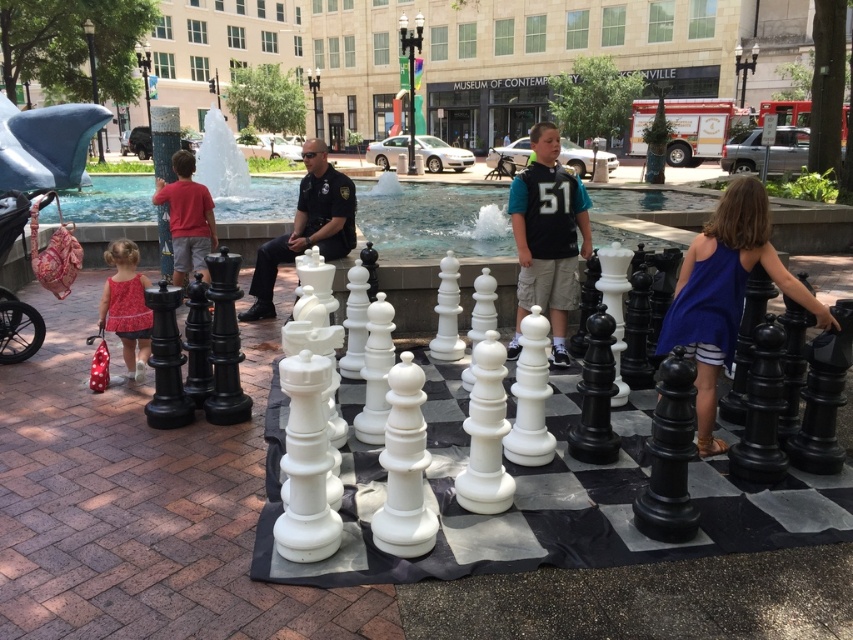
Question: From the image, what is the correct spatial relationship of blue fabric dress at right in relation to matte black uniform at center?

Choices:
 (A) below
 (B) above

Answer: (A)

Question: Is matte black uniform at center below matte red dress at left?

Choices:
 (A) yes
 (B) no

Answer: (B)

Question: Estimate the real-world distances between objects in this image. Which object is closer to the blue fabric dress at right?

Choices:
 (A) matte black uniform at center
 (B) matte red dress at left

Answer: (A)

Question: Among these objects, which one is farthest from the camera?

Choices:
 (A) blue fabric dress at right
 (B) matte red dress at left

Answer: (B)

Question: Observing the image, what is the correct spatial positioning of blue fabric dress at right in reference to matte black uniform at center?

Choices:
 (A) left
 (B) right

Answer: (B)

Question: Among these objects, which one is nearest to the camera?

Choices:
 (A) matte black uniform at center
 (B) blue fabric dress at right
 (C) matte red dress at left

Answer: (B)